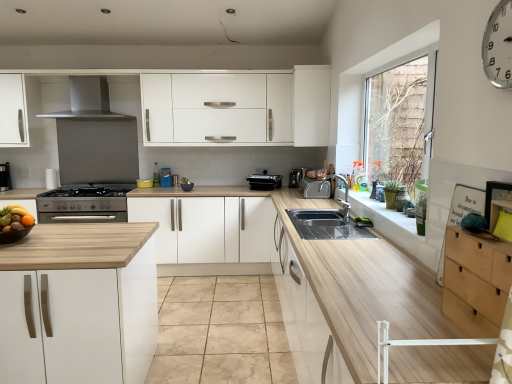
Locate an element on the screen. vacant space behind beech wood drawer at right, which appears as the first cabinetry when viewed from the front is located at coordinates (x=415, y=302).